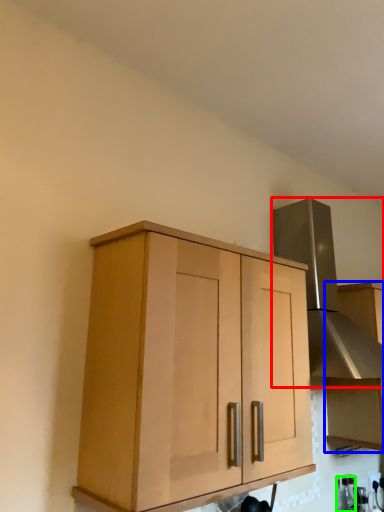
Question: Which object is the farthest from vent (highlighted by a red box)? Choose among these: cabinetry (highlighted by a blue box) or bottle (highlighted by a green box).

Choices:
 (A) cabinetry
 (B) bottle

Answer: (B)